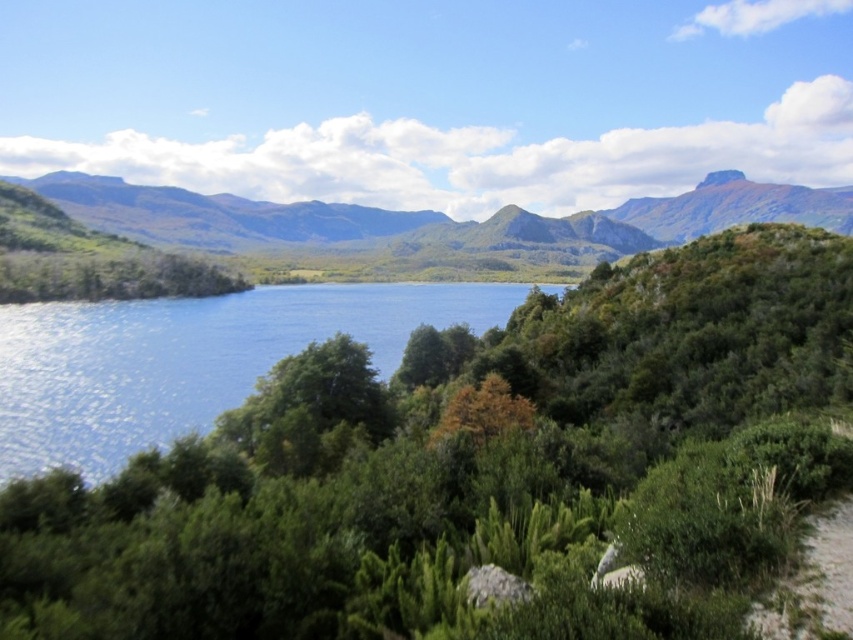
You are standing at the edge of the lake and want to place a small wooden bench between the green leafy tree at center and the blue liquid water at center. Based on their widths, which object should you position the bench closer to?

The green leafy tree at center has a lesser width compared to blue liquid water at center, so you should position the bench closer to the green leafy tree at center to ensure it fits within the available space.

You are standing at the point labeled as point [480,470] in the image. What object is located exactly at this point?

The green leafy tree at center is located exactly at point [480,470].